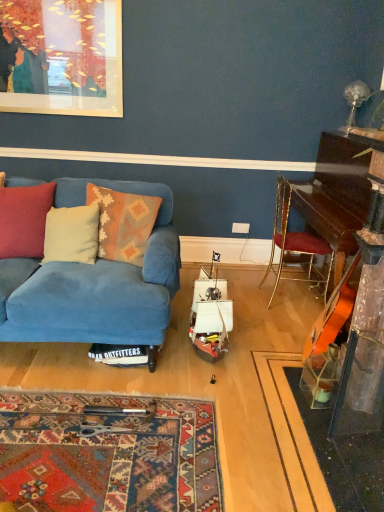
Question: Is point (246, 224) positioned closer to the camera than point (307, 197)?

Choices:
 (A) farther
 (B) closer

Answer: (A)

Question: From a real-world perspective, is white plastic power outlet at center above or below shiny dark wood piano at right?

Choices:
 (A) below
 (B) above

Answer: (A)

Question: Estimate the real-world distances between objects in this image. Which object is farther from the shiny dark wood piano at right?

Choices:
 (A) blue fabric couch at left
 (B) white plastic power outlet at center
 (C) transparent glass guitar at right
 (D) matte red pillow at left, acting as the 1th pillow starting from the left
 (E) gold metallic chair at right

Answer: (D)

Question: Considering the real-world distances, which object is farthest from the transparent glass guitar at right?

Choices:
 (A) knitted wool pillow at center, acting as the 3th pillow starting from the left
 (B) matte red pillow at left, acting as the 1th pillow starting from the left
 (C) shiny dark wood piano at right
 (D) gold metallic chair at right
 (E) beige fabric pillow at left, which ranks as the 2th pillow in left-to-right order

Answer: (B)